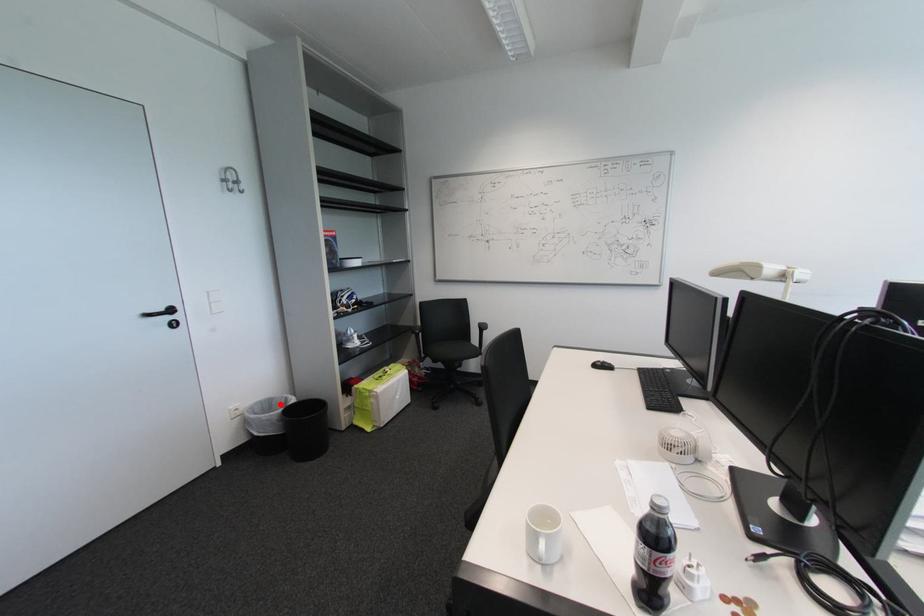
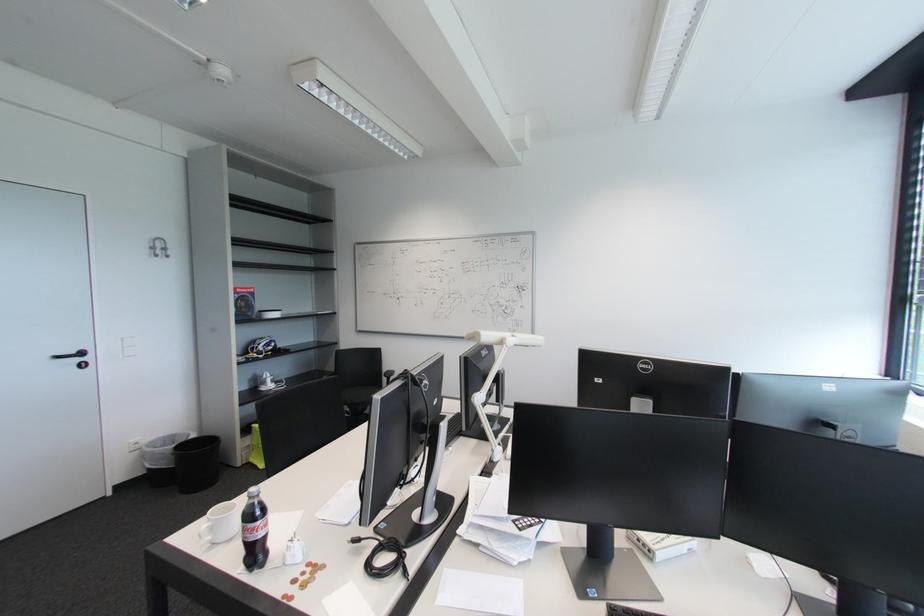
The point at the highlighted location is marked in the first image. Where is the corresponding point in the second image?

(184, 440)